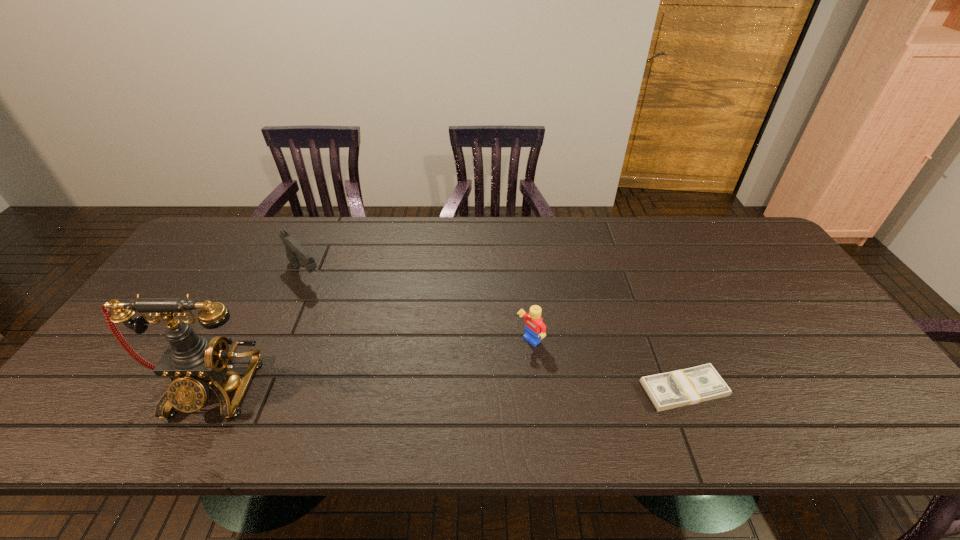
Where is `vacant space located 0.080m on the face of the Lego`? Image resolution: width=960 pixels, height=540 pixels. vacant space located 0.080m on the face of the Lego is located at coordinates (497, 364).

I want to click on vacant space situated on the face of the Lego, so click(x=494, y=366).

At what (x,y) coordinates should I click in order to perform the action: click on free region located on the face of the Lego. Please return your answer as a coordinate pair (x, y). Looking at the image, I should click on (497, 364).

I want to click on object located in the far edge section of the desktop, so click(294, 251).

Where is `telephone situated at the near edge`? This screenshot has height=540, width=960. telephone situated at the near edge is located at coordinates (193, 362).

In order to click on dollar situated at the near edge in this screenshot , I will do `click(689, 386)`.

This screenshot has width=960, height=540. What are the coordinates of `free space at the far edge of the desktop` in the screenshot? It's located at (589, 246).

Identify the location of vacant area at the near edge. (334, 388).

Locate an element on the screen. This screenshot has height=540, width=960. vacant space at the left edge is located at coordinates (115, 363).

The width and height of the screenshot is (960, 540). I want to click on free space at the right edge of the desktop, so click(785, 294).